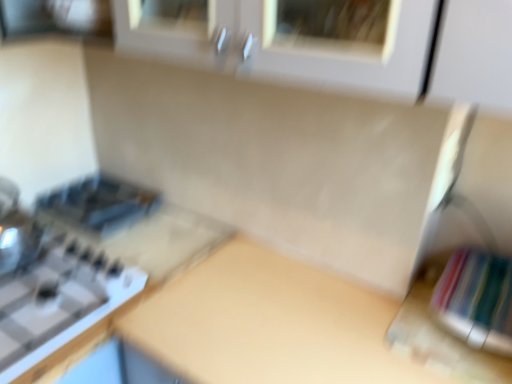
Question: Based on their positions, is beige matte counter top at center located to the left or right of satin black toaster at left?

Choices:
 (A) right
 (B) left

Answer: (A)

Question: From the image's perspective, relative to satin black toaster at left, is beige matte counter top at center above or below?

Choices:
 (A) below
 (B) above

Answer: (A)

Question: Which object is the farthest from the satin black toaster at left?

Choices:
 (A) white glossy gas stove at left
 (B) beige matte counter top at center

Answer: (B)

Question: Estimate the real-world distances between objects in this image. Which object is farther from the beige matte counter top at center?

Choices:
 (A) satin black toaster at left
 (B) white glossy gas stove at left

Answer: (A)